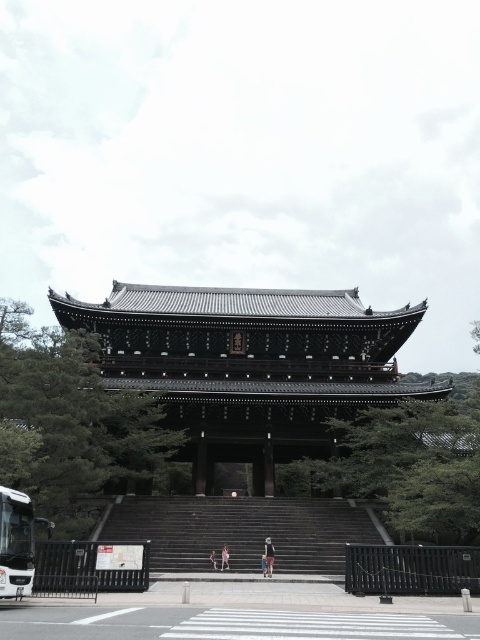
You are standing at the base of the stone steps leading to the shiny dark wood temple at center. If you want to take a photo of the temple from directly in front, which direction should you move to align yourself with the temple?

Since the shiny dark wood temple at center is positioned at point (250, 364), you should move towards the center of the image to align yourself directly in front of it.

You are standing at the base of the stone steps leading to the shiny dark wood temple at center. You notice the light blue denim shorts at center nearby. Which object is higher in elevation?

The shiny dark wood temple at center is located above the light blue denim shorts at center, so the temple is higher in elevation.